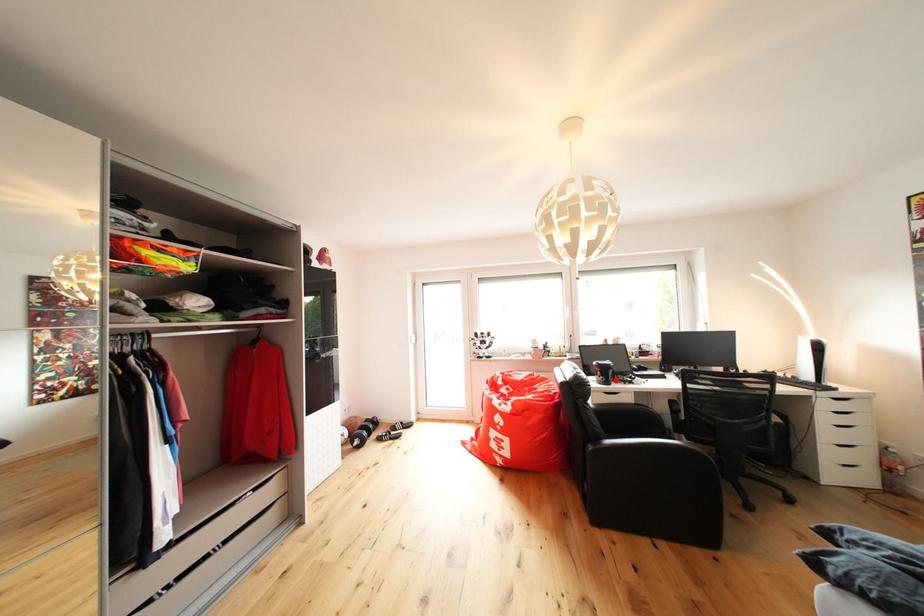
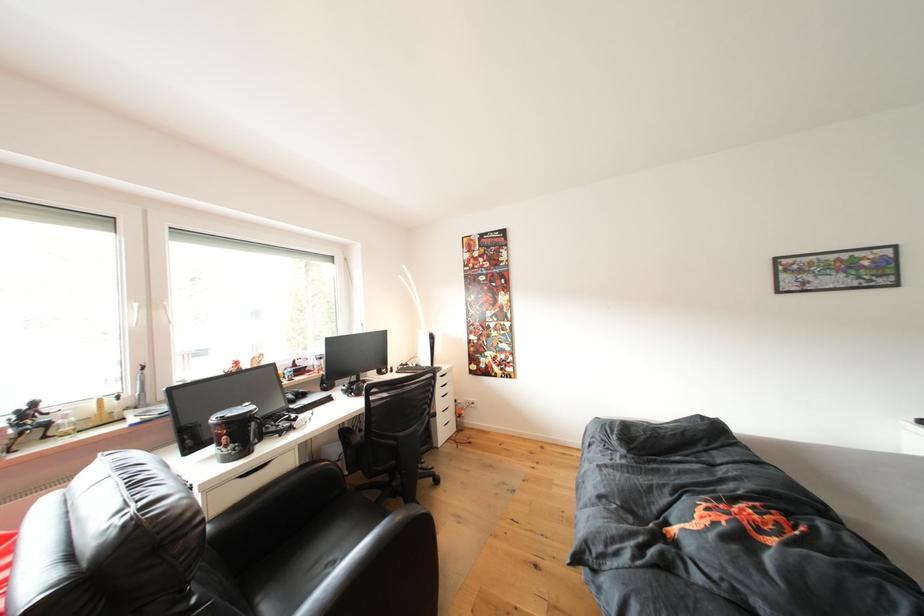
In the second image, find the point that corresponds to the highlighted location in the first image.

(253, 440)